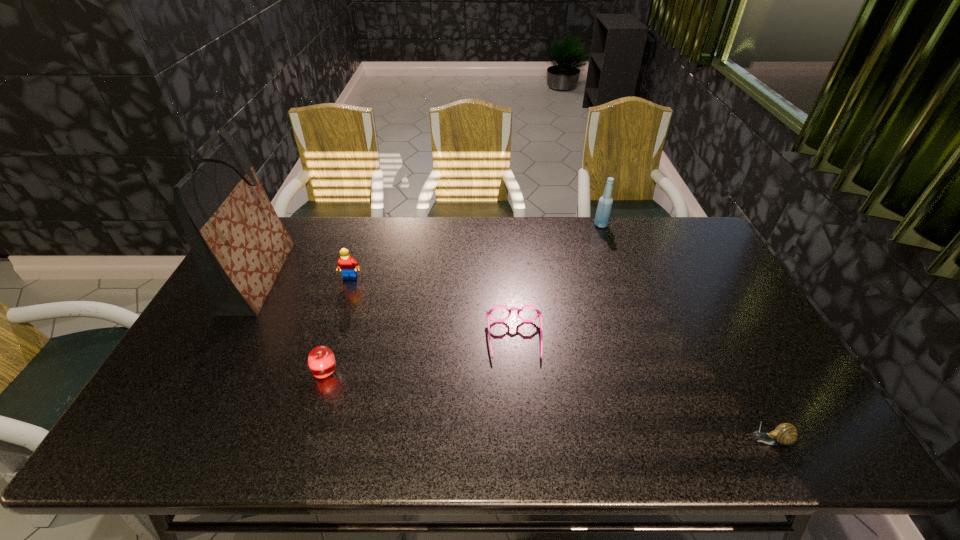
This screenshot has height=540, width=960. Identify the location of the tallest object. (240, 245).

The image size is (960, 540). What are the coordinates of `shopping bag` in the screenshot? It's located at click(240, 245).

Locate an element on the screen. the second tallest object is located at coordinates (603, 212).

Where is `bottle`? bottle is located at coordinates (603, 212).

The width and height of the screenshot is (960, 540). I want to click on the third tallest object, so click(347, 265).

Identify the location of the third shortest object. Image resolution: width=960 pixels, height=540 pixels. (321, 361).

This screenshot has height=540, width=960. I want to click on spectacles, so click(x=488, y=313).

Where is `the nearest object`? This screenshot has height=540, width=960. the nearest object is located at coordinates (784, 434).

Find the location of `the rightmost object`. the rightmost object is located at coordinates (784, 434).

The image size is (960, 540). In order to click on vacant space located on the front-facing side of the tallest object in this screenshot , I will do `click(361, 277)`.